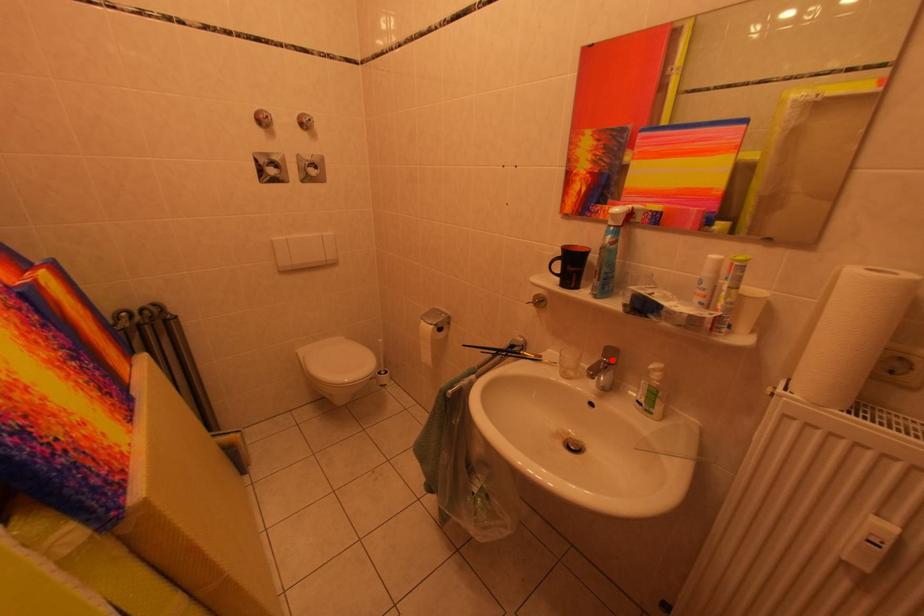
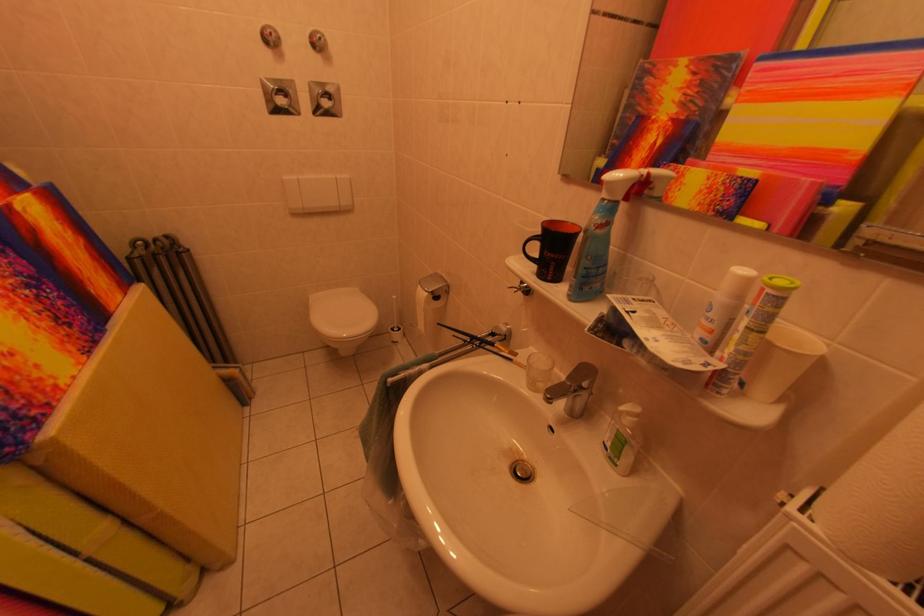
Locate, in the second image, the point that corresponds to the highlighted location in the first image.

(578, 382)